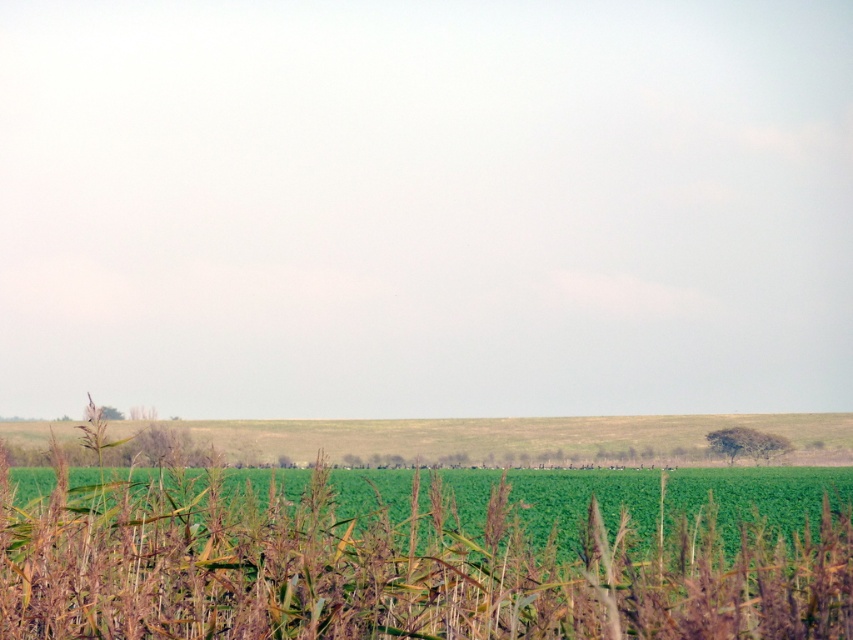
Between green matte corn field at center and green grass at lower center, which one is positioned lower?

Positioned lower is green grass at lower center.

Is point (1, 545) positioned in front of point (807, 426)?

Yes, it is in front of point (807, 426).

Describe the element at coordinates (396, 566) in the screenshot. I see `green matte corn field at center` at that location.

Locate an element on the screen. This screenshot has height=640, width=853. green matte corn field at center is located at coordinates (396, 566).